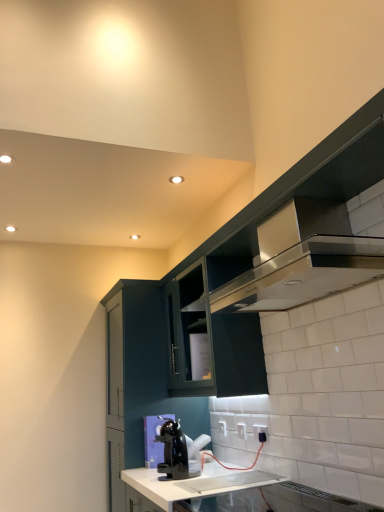
Question: Is satin black cabinet at upper right, arranged as the 1th cabinetry when viewed from the right, thinner than matte dark green cabinet at upper center, which ranks as the second cabinetry in right-to-left order?

Choices:
 (A) no
 (B) yes

Answer: (B)

Question: Are satin black cabinet at upper right, which is the third cabinetry in left-to-right order, and matte dark green cabinet at upper center, the second cabinetry when ordered from left to right, far apart?

Choices:
 (A) yes
 (B) no

Answer: (B)

Question: From the image's perspective, would you say satin black cabinet at upper right, arranged as the 1th cabinetry when viewed from the right, is shown under matte dark green cabinet at upper center, the second cabinetry when ordered from left to right?

Choices:
 (A) yes
 (B) no

Answer: (A)

Question: Is satin black cabinet at upper right, arranged as the 1th cabinetry when viewed from the right, oriented towards matte dark green cabinet at upper center, the second cabinetry when ordered from left to right?

Choices:
 (A) yes
 (B) no

Answer: (A)

Question: Considering the relative sizes of satin black cabinet at upper right, which is the third cabinetry in left-to-right order, and matte dark green cabinet at upper center, which ranks as the second cabinetry in right-to-left order, in the image provided, is satin black cabinet at upper right, which is the third cabinetry in left-to-right order, smaller than matte dark green cabinet at upper center, which ranks as the second cabinetry in right-to-left order,?

Choices:
 (A) no
 (B) yes

Answer: (B)

Question: Can you confirm if satin black cabinet at upper right, arranged as the 1th cabinetry when viewed from the right, is bigger than matte dark green cabinet at upper center, the second cabinetry when ordered from left to right?

Choices:
 (A) yes
 (B) no

Answer: (B)

Question: Does satin black cabinet at upper right, arranged as the 1th cabinetry when viewed from the right, appear on the right side of matte dark green cabinet at center, positioned as the third cabinetry in right-to-left order?

Choices:
 (A) no
 (B) yes

Answer: (B)

Question: From the image's perspective, is satin black cabinet at upper right, arranged as the 1th cabinetry when viewed from the right, on top of matte dark green cabinet at center, which is the first cabinetry from left to right?

Choices:
 (A) yes
 (B) no

Answer: (A)

Question: Considering the relative positions of satin black cabinet at upper right, which is the third cabinetry in left-to-right order, and matte dark green cabinet at center, positioned as the third cabinetry in right-to-left order, in the image provided, is satin black cabinet at upper right, which is the third cabinetry in left-to-right order, to the left of matte dark green cabinet at center, positioned as the third cabinetry in right-to-left order, from the viewer's perspective?

Choices:
 (A) yes
 (B) no

Answer: (B)

Question: Is satin black cabinet at upper right, arranged as the 1th cabinetry when viewed from the right, taller than matte dark green cabinet at center, positioned as the third cabinetry in right-to-left order?

Choices:
 (A) no
 (B) yes

Answer: (A)

Question: From a real-world perspective, is satin black cabinet at upper right, which is the third cabinetry in left-to-right order, beneath matte dark green cabinet at center, positioned as the third cabinetry in right-to-left order?

Choices:
 (A) no
 (B) yes

Answer: (A)

Question: Is matte dark green cabinet at center, which is the first cabinetry from left to right, at the back of satin black cabinet at upper right, arranged as the 1th cabinetry when viewed from the right?

Choices:
 (A) yes
 (B) no

Answer: (B)

Question: Is satin silver exhaust hood at upper right not within white plastic electric outlet at lower center, which is the second electric outlet in left-to-right order?

Choices:
 (A) no
 (B) yes

Answer: (B)